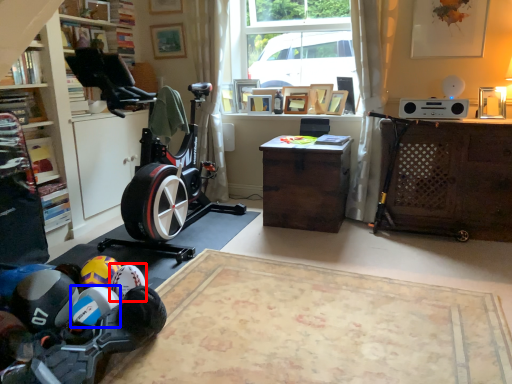
Question: Which object is closer to the camera taking this photo, toy (highlighted by a red box) or toy (highlighted by a blue box)?

Choices:
 (A) toy
 (B) toy

Answer: (B)